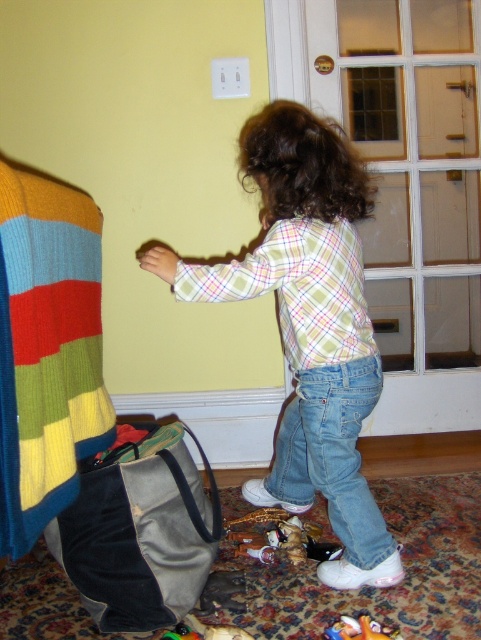
Is plaid shirt at center thinner than gray fabric bag at lower left?

In fact, plaid shirt at center might be wider than gray fabric bag at lower left.

Who is more distant from viewer, (342, 349) or (167, 445)?

The point (342, 349) is more distant.

The width and height of the screenshot is (481, 640). Describe the element at coordinates (308, 326) in the screenshot. I see `plaid shirt at center` at that location.

The width and height of the screenshot is (481, 640). Identify the location of plaid shirt at center. (308, 326).

Who is more forward, (x=53, y=186) or (x=240, y=532)?

Positioned in front is point (x=53, y=186).

Is point (50, 412) positioned after point (271, 556)?

No, (50, 412) is in front of (271, 556).

Identify the location of multicolored knitted blanket at left. This screenshot has height=640, width=481. (47, 349).

Does multicolored knitted blanket at left appear on the left side of plush yellow toy at lower center?

Yes, multicolored knitted blanket at left is to the left of plush yellow toy at lower center.

From the picture: Does multicolored knitted blanket at left have a lesser height compared to plush yellow toy at lower center?

No.

Is point (25, 264) less distant than point (346, 637)?

Yes, it is.

In order to click on multicolored knitted blanket at left in this screenshot , I will do `click(47, 349)`.